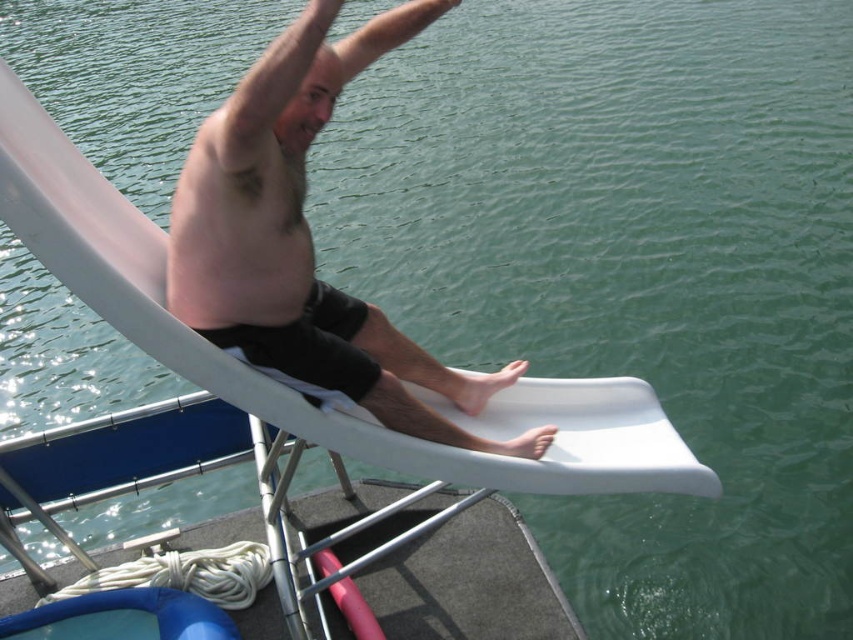
Question: Is smooth skin man at center above pink smooth skin at upper center?

Choices:
 (A) no
 (B) yes

Answer: (A)

Question: Which object appears closest to the camera in this image?

Choices:
 (A) smooth skin man at center
 (B) pink smooth skin at upper center

Answer: (A)

Question: Is smooth skin man at center wider than pink smooth skin at upper center?

Choices:
 (A) yes
 (B) no

Answer: (A)

Question: Which object is closer to the camera taking this photo?

Choices:
 (A) smooth skin man at center
 (B) pink smooth skin at upper center

Answer: (A)

Question: Can you confirm if smooth skin man at center is positioned to the right of pink smooth skin at upper center?

Choices:
 (A) no
 (B) yes

Answer: (B)